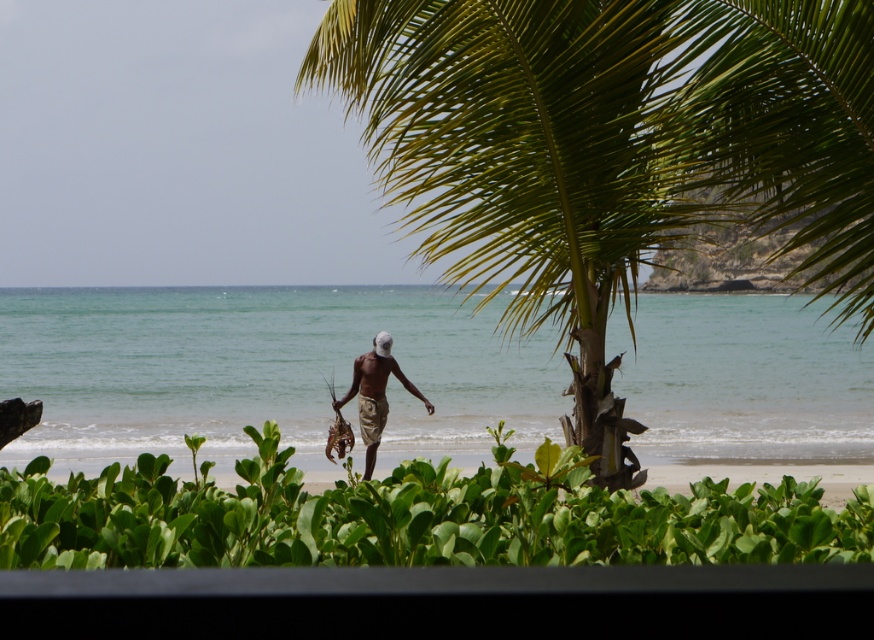
Is green leafy palm tree at center below brown fabric man at center?

No.

Can you confirm if green leafy palm tree at center is taller than brown fabric man at center?

Correct, green leafy palm tree at center is much taller as brown fabric man at center.

The width and height of the screenshot is (874, 640). What are the coordinates of `green leafy palm tree at center` in the screenshot? It's located at (609, 148).

This screenshot has height=640, width=874. I want to click on green leafy palm tree at center, so click(609, 148).

This screenshot has height=640, width=874. Describe the element at coordinates (609, 148) in the screenshot. I see `green leafy palm tree at center` at that location.

Can you confirm if green leafy palm tree at center is bigger than green leafy shrub at lower center?

Correct, green leafy palm tree at center is larger in size than green leafy shrub at lower center.

Where is `green leafy palm tree at center`? Image resolution: width=874 pixels, height=640 pixels. green leafy palm tree at center is located at coordinates (609, 148).

This screenshot has height=640, width=874. What are the coordinates of `green leafy palm tree at center` in the screenshot? It's located at pyautogui.click(x=609, y=148).

Between green leafy shrub at lower center and brown fabric man at center, which one is positioned lower?

Positioned lower is brown fabric man at center.

In the scene shown: Does green leafy shrub at lower center have a lesser height compared to brown fabric man at center?

Yes.

Which is in front, point (609, 540) or point (380, 413)?

Point (609, 540)

Find the location of `green leafy shrub at lower center`. green leafy shrub at lower center is located at coordinates (413, 516).